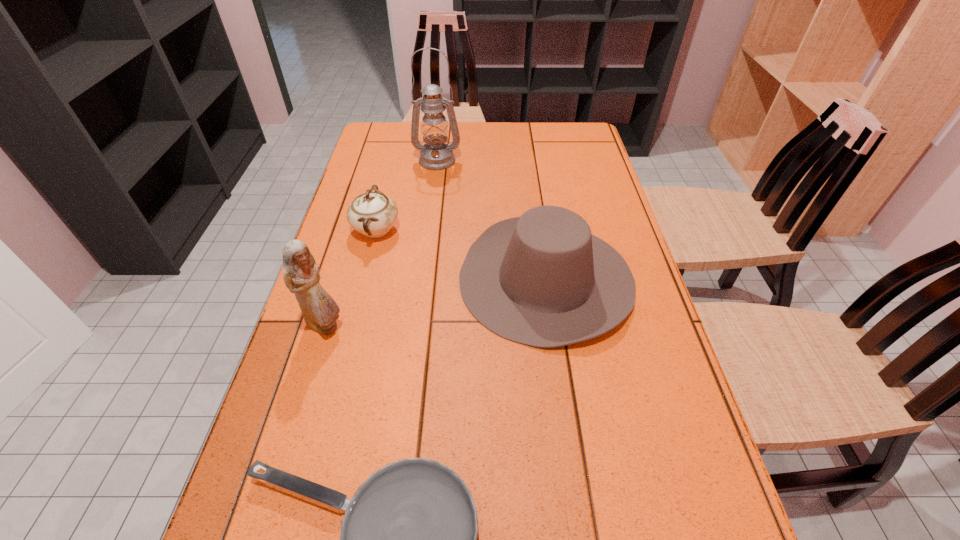
The width and height of the screenshot is (960, 540). What are the coordinates of `figurine at the left edge` in the screenshot? It's located at (301, 276).

Where is `chinaware at the left edge`? The width and height of the screenshot is (960, 540). chinaware at the left edge is located at coordinates (373, 214).

In order to click on object situated at the right edge in this screenshot , I will do `click(542, 279)`.

Locate an element on the screen. This screenshot has height=540, width=960. vacant space at the far edge of the desktop is located at coordinates (470, 127).

Locate an element on the screen. The image size is (960, 540). vacant position at the left edge of the desktop is located at coordinates (378, 157).

Identify the location of vacant position at the right edge of the desktop. pyautogui.click(x=651, y=521).

At what (x,y) coordinates should I click in order to perform the action: click on vacant area between the figurine and the second shortest object. Please return your answer as a coordinate pair (x, y). Looking at the image, I should click on (350, 278).

Identify the location of free area in between the chinaware and the third tallest object. (461, 254).

Find the location of a particular element. empty location between the third shortest object and the second shortest object is located at coordinates (461, 254).

The width and height of the screenshot is (960, 540). I want to click on empty space between the oil lamp and the third tallest object, so click(x=492, y=219).